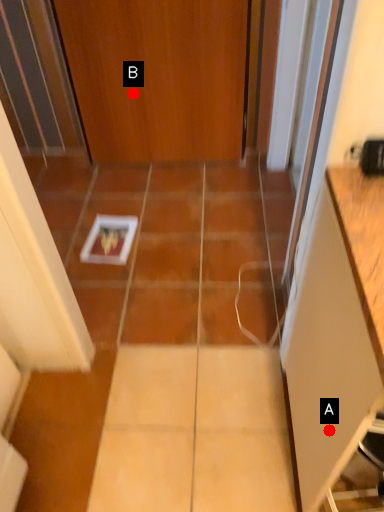
Question: Two points are circled on the image, labeled by A and B beside each circle. Which of the following is the closest to the observer?

Choices:
 (A) A is closer
 (B) B is closer

Answer: (A)